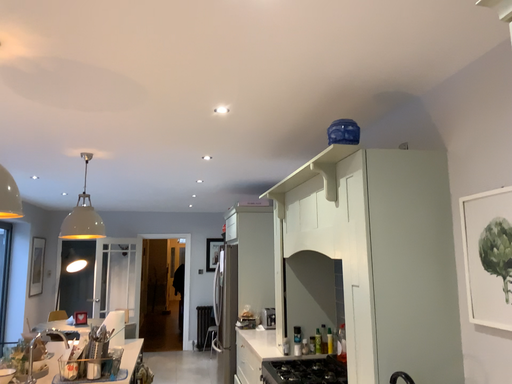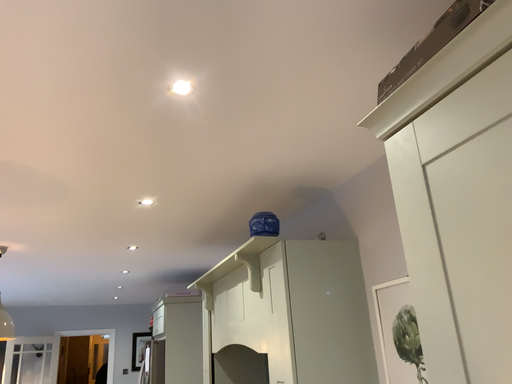
Question: Which way did the camera rotate in the video?

Choices:
 (A) rotated left
 (B) rotated right

Answer: (B)